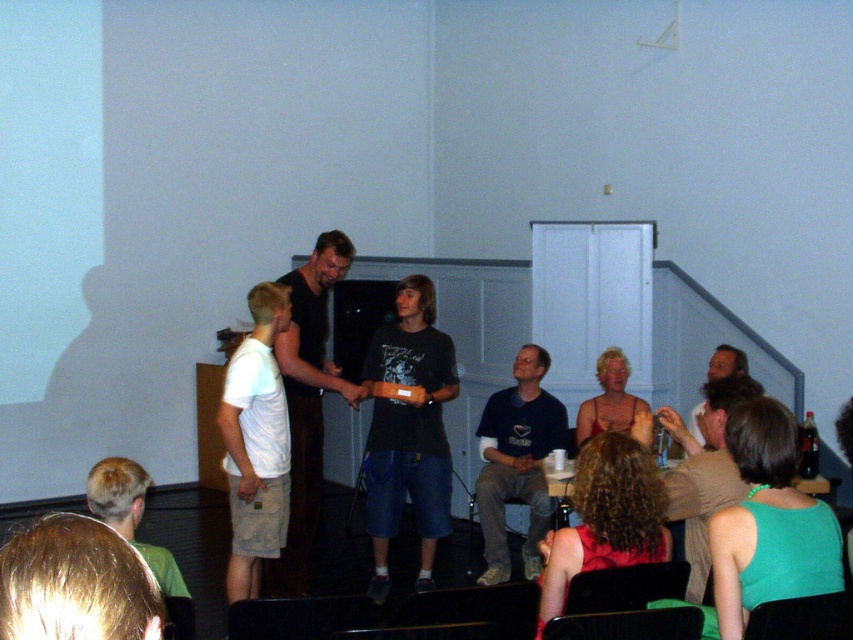
Question: Can you confirm if black matte shirt at center is wider than matte red tank top at center?

Choices:
 (A) no
 (B) yes

Answer: (B)

Question: Is green fabric tank top at lower right behind blonde hair at lower left?

Choices:
 (A) no
 (B) yes

Answer: (B)

Question: Is dark blue denim shorts at center behind curly hair at lower center?

Choices:
 (A) no
 (B) yes

Answer: (B)

Question: Which is farther from the curly hair at lower center?

Choices:
 (A) blonde hair at lower left
 (B) matte red tank top at center
 (C) dark blue t-shirt at center
 (D) short brown hair at lower left

Answer: (B)

Question: Which object appears closest to the camera in this image?

Choices:
 (A) white cotton t-shirt at center
 (B) green fabric tank top at lower right
 (C) blonde hair at lower left

Answer: (C)

Question: Among these objects, which one is farthest from the camera?

Choices:
 (A) dark blue t-shirt at center
 (B) blonde hair at lower left

Answer: (A)